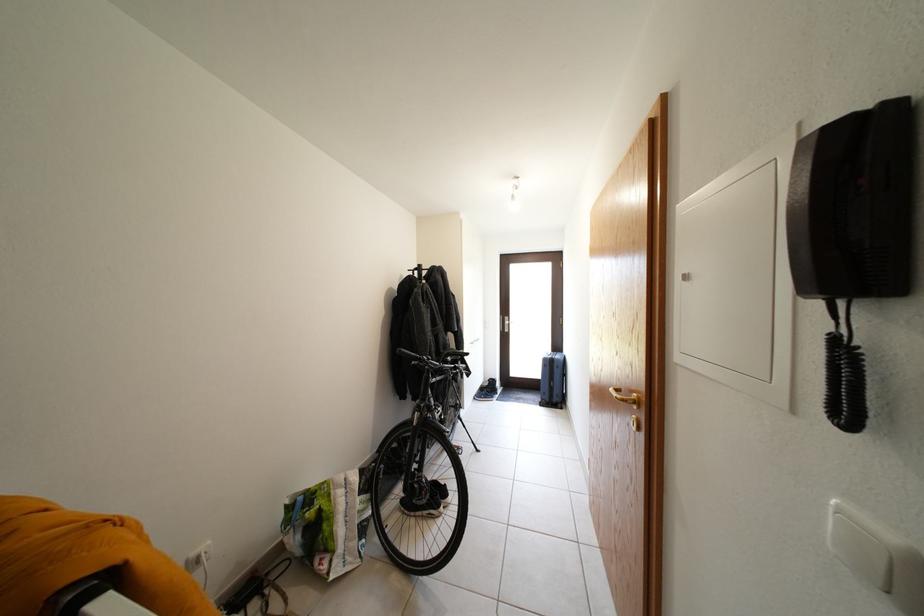
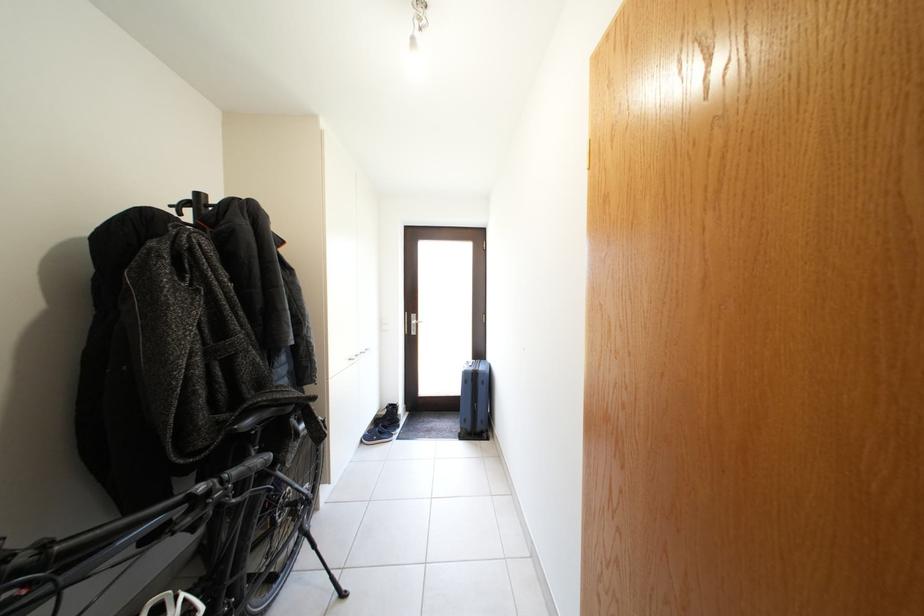
In the second image, find the point that corresponds to point (553, 365) in the first image.

(473, 379)